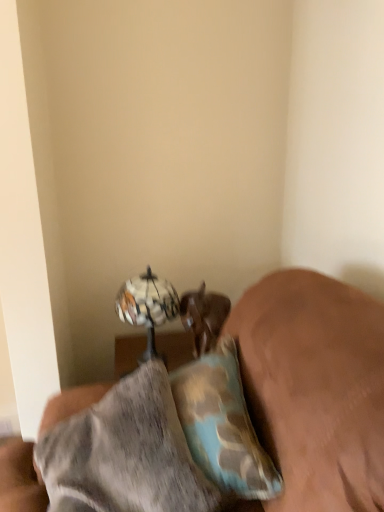
You are a GUI agent. You are given a task and a screenshot of the screen. Output one action in this format:
    pyautogui.click(x=<x>, y=<y>)
    Task: Click on the camouflage fabric pillow at lower right
    
    Given the screenshot: What is the action you would take?
    pyautogui.click(x=223, y=425)

The height and width of the screenshot is (512, 384). What do you see at coordinates (203, 317) in the screenshot?
I see `brown leather dog at lower center` at bounding box center [203, 317].

This screenshot has width=384, height=512. What do you see at coordinates (147, 306) in the screenshot? I see `metallic reflective globe at upper center` at bounding box center [147, 306].

Locate an element on the screen. The width and height of the screenshot is (384, 512). camouflage fabric pillow at lower right is located at coordinates (223, 425).

Can you see camouflage fabric pillow at lower right touching metallic reflective globe at upper center?

They are not placed beside each other.

Considering the sizes of objects camouflage fabric pillow at lower right and metallic reflective globe at upper center in the image provided, who is shorter, camouflage fabric pillow at lower right or metallic reflective globe at upper center?

Standing shorter between the two is camouflage fabric pillow at lower right.

Can you confirm if camouflage fabric pillow at lower right is thinner than metallic reflective globe at upper center?

Correct, the width of camouflage fabric pillow at lower right is less than that of metallic reflective globe at upper center.

In the image, is camouflage fabric pillow at lower right on the left side or the right side of metallic reflective globe at upper center?

camouflage fabric pillow at lower right is positioned on metallic reflective globe at upper center's right side.

Is point (223, 317) closer or farther from the camera than point (173, 310)?

Point (223, 317) is positioned closer to the camera compared to point (173, 310).

The image size is (384, 512). Find the location of `table lamp that appears in front of the brown leather dog at lower center`. table lamp that appears in front of the brown leather dog at lower center is located at coordinates (147, 306).

How far apart are brown leather dog at lower center and metallic reflective globe at upper center?

brown leather dog at lower center and metallic reflective globe at upper center are 5.46 inches apart from each other.

In terms of size, does brown leather dog at lower center appear bigger or smaller than metallic reflective globe at upper center?

brown leather dog at lower center is smaller than metallic reflective globe at upper center.

Consider the image. Does camouflage fabric pillow at lower right come in front of brown leather dog at lower center?

Yes, camouflage fabric pillow at lower right is closer to the viewer.

Does point (199, 384) lie in front of point (228, 300)?

That is True.

From the image's perspective, would you say metallic reflective globe at upper center is shown under brown leather dog at lower center?

No, from the image's perspective, metallic reflective globe at upper center is not beneath brown leather dog at lower center.

Considering the sizes of objects metallic reflective globe at upper center and brown leather dog at lower center in the image provided, who is shorter, metallic reflective globe at upper center or brown leather dog at lower center?

With less height is brown leather dog at lower center.

Is metallic reflective globe at upper center at the left side of brown leather dog at lower center?

Yes, metallic reflective globe at upper center is to the left of brown leather dog at lower center.

Is metallic reflective globe at upper center not within camouflage fabric pillow at lower right?

Absolutely, metallic reflective globe at upper center is external to camouflage fabric pillow at lower right.

Is metallic reflective globe at upper center positioned with its back to camouflage fabric pillow at lower right?

No.

Considering the points (162, 358) and (199, 376), which point is behind, point (162, 358) or point (199, 376)?

The point (162, 358) is more distant.

In the scene shown: Which of these two, metallic reflective globe at upper center or camouflage fabric pillow at lower right, stands taller?

With more height is metallic reflective globe at upper center.

Can you confirm if camouflage-patterned pillow at center is thinner than metallic reflective globe at upper center?

In fact, camouflage-patterned pillow at center might be wider than metallic reflective globe at upper center.

Who is taller, camouflage-patterned pillow at center or metallic reflective globe at upper center?

With more height is camouflage-patterned pillow at center.

Which is in front, point (305, 341) or point (132, 303)?

The point (305, 341) is more forward.

Is the depth of camouflage-patterned pillow at center greater than that of metallic reflective globe at upper center?

No, camouflage-patterned pillow at center is in front of metallic reflective globe at upper center.

Is there a large distance between brown leather dog at lower center and camouflage-patterned pillow at center?

They are positioned close to each other.

Is brown leather dog at lower center positioned before camouflage-patterned pillow at center?

No, brown leather dog at lower center is further to the viewer.

From a real-world perspective, which is physically below, brown leather dog at lower center or camouflage-patterned pillow at center?

In real-world perspective, brown leather dog at lower center is lower.

Find the location of a particular element. Image resolution: width=384 pixels, height=512 pixels. table lamp beneath the camouflage fabric pillow at lower right (from a real-world perspective) is located at coordinates (147, 306).

At what (x,y) coordinates should I click in order to perform the action: click on animal lying on the right of metallic reflective globe at upper center. Please return your answer as a coordinate pair (x, y). The height and width of the screenshot is (512, 384). Looking at the image, I should click on (203, 317).

Considering their positions, is brown leather dog at lower center positioned further to metallic reflective globe at upper center than camouflage-patterned pillow at center?

camouflage-patterned pillow at center.

Estimate the real-world distances between objects in this image. Which object is closer to metallic reflective globe at upper center, camouflage fabric pillow at lower right or brown leather dog at lower center?

brown leather dog at lower center lies closer to metallic reflective globe at upper center than the other object.

Looking at the image, which one is located further to camouflage-patterned pillow at center, metallic reflective globe at upper center or camouflage fabric pillow at lower right?

metallic reflective globe at upper center is further to camouflage-patterned pillow at center.

Looking at the image, which one is located closer to metallic reflective globe at upper center, brown leather dog at lower center or camouflage fabric pillow at lower right?

brown leather dog at lower center is closer to metallic reflective globe at upper center.

Which object lies further to the anchor point camouflage fabric pillow at lower right, brown leather dog at lower center or metallic reflective globe at upper center?

metallic reflective globe at upper center lies further to camouflage fabric pillow at lower right than the other object.

Looking at the image, which one is located closer to camouflage fabric pillow at lower right, metallic reflective globe at upper center or brown leather dog at lower center?

Based on the image, brown leather dog at lower center appears to be nearer to camouflage fabric pillow at lower right.

Looking at the image, which one is located closer to camouflage-patterned pillow at center, metallic reflective globe at upper center or brown leather dog at lower center?

brown leather dog at lower center is positioned closer to the anchor camouflage-patterned pillow at center.

Which object lies further to the anchor point camouflage fabric pillow at lower right, camouflage-patterned pillow at center or metallic reflective globe at upper center?

metallic reflective globe at upper center is further to camouflage fabric pillow at lower right.

Locate an element on the screen. table lamp positioned between camouflage fabric pillow at lower right and brown leather dog at lower center from near to far is located at coordinates (147, 306).

Locate an element on the screen. table lamp between camouflage-patterned pillow at center and brown leather dog at lower center from front to back is located at coordinates 147,306.

The width and height of the screenshot is (384, 512). In order to click on pillow between camouflage-patterned pillow at center and brown leather dog at lower center in the front-back direction in this screenshot , I will do `click(223, 425)`.

Find the location of a particular element. pillow positioned between camouflage-patterned pillow at center and metallic reflective globe at upper center from near to far is located at coordinates (223, 425).